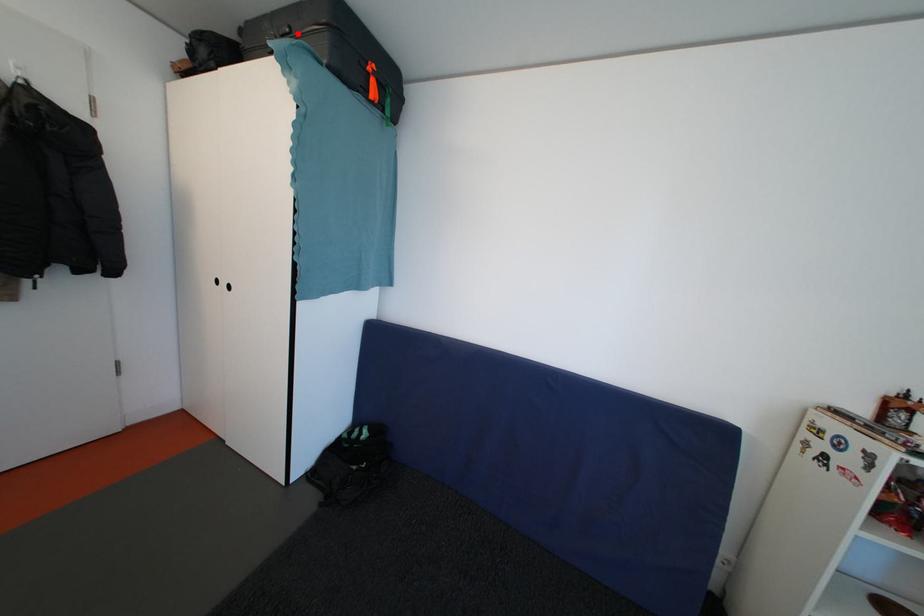
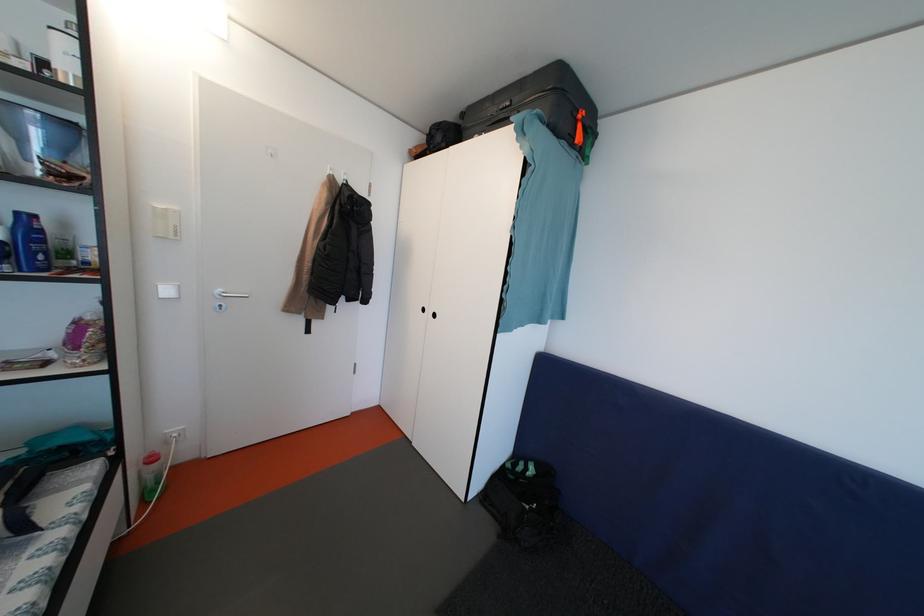
Find the pixel in the second image that matches the highlighted location in the first image.

(518, 107)